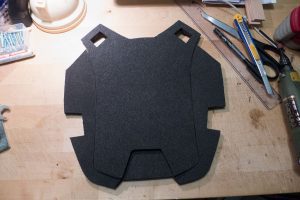
What are the coordinates of `marker` in the screenshot? It's located at (232, 48).